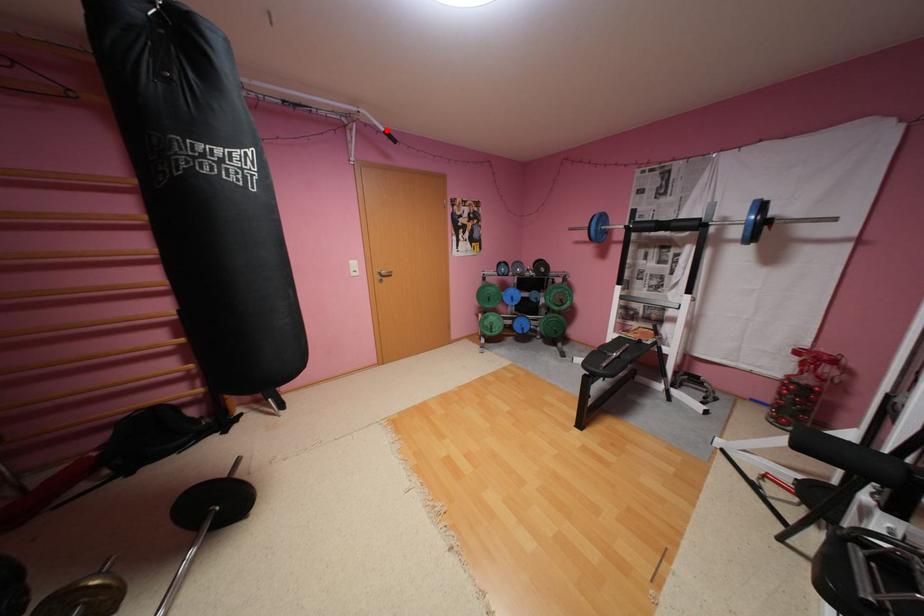
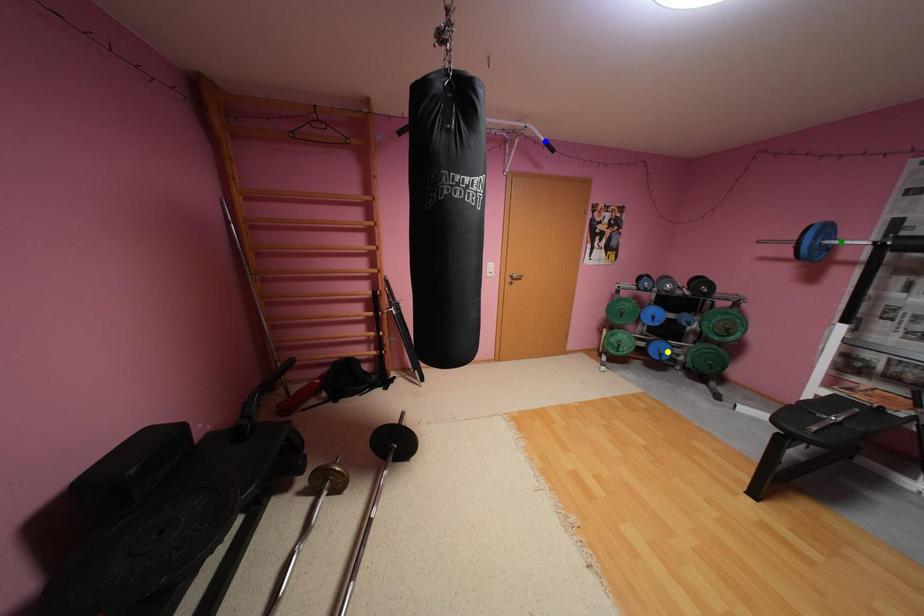
Question: I am providing you with two images of the same scene from different viewpoints. A red point is marked on the first image. You are given multiple points on the second image. Can you choose the point in image 2 that corresponds to the point in image 1?

Choices:
 (A) yellow point
 (B) blue point
 (C) green point

Answer: (B)